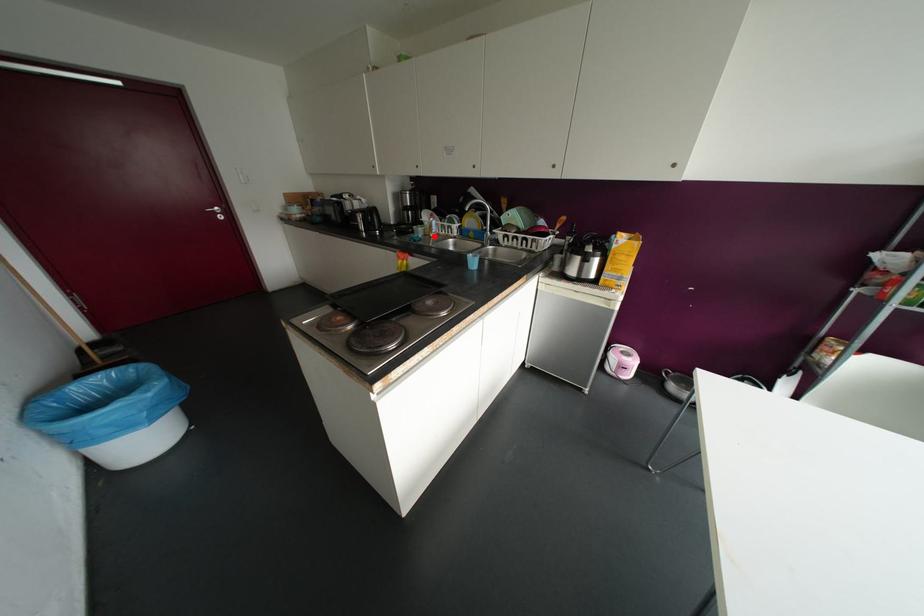
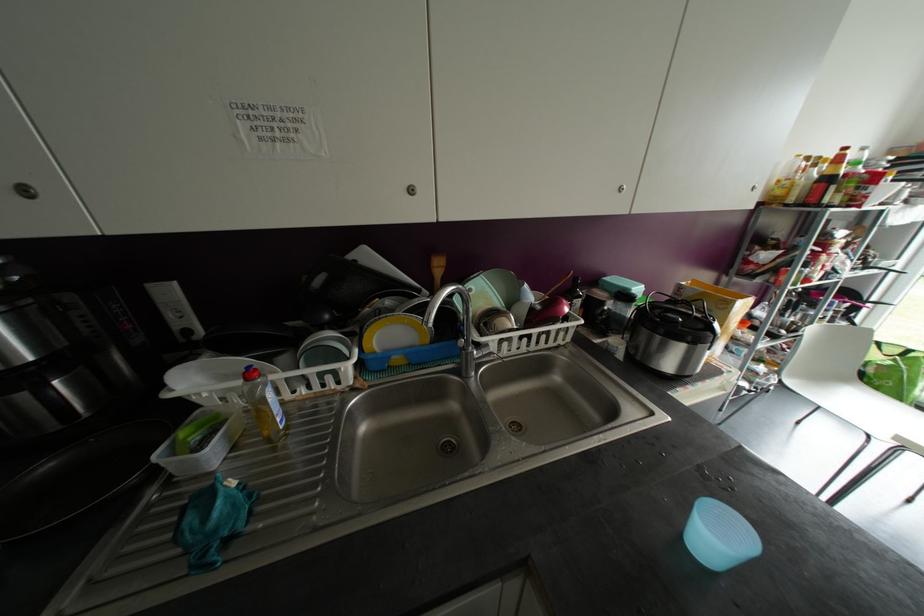
Locate, in the second image, the point that corresponds to the highlighted location in the first image.

(286, 427)